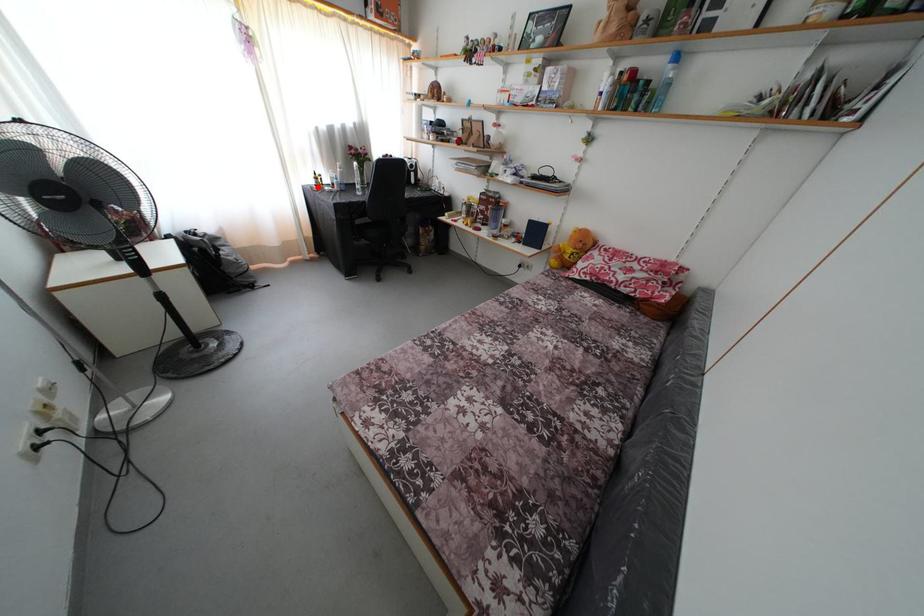
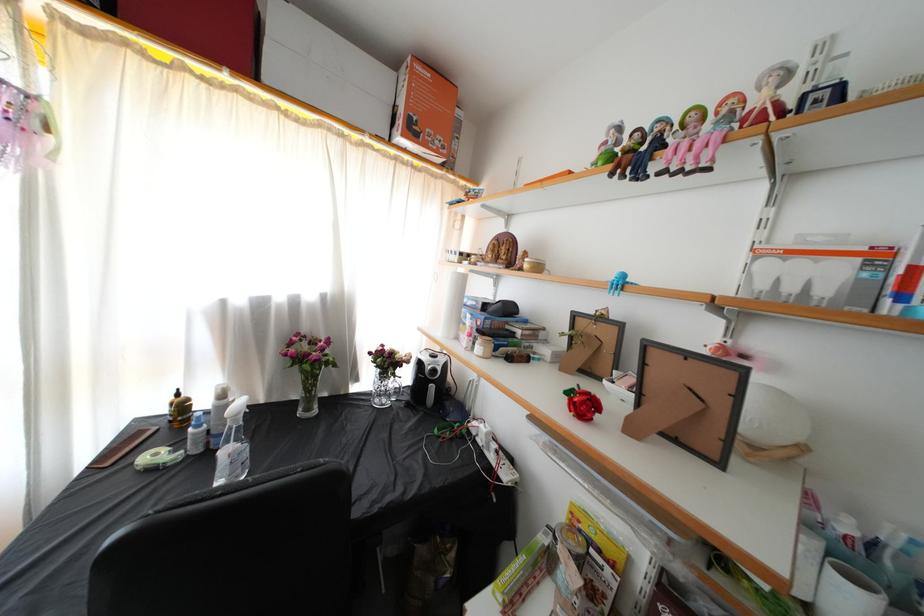
Find the pixel in the second image that matches the highlighted location in the first image.

(171, 416)